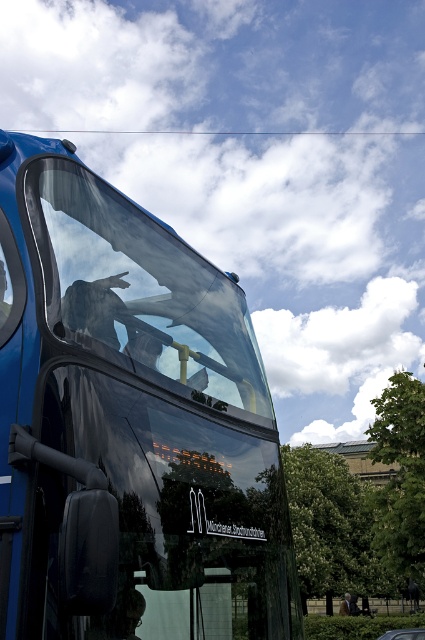
Question: Which of the following is the closest to the observer?

Choices:
 (A) click(147, 300)
 (B) click(124, 600)

Answer: (B)

Question: Which object appears farthest from the camera in this image?

Choices:
 (A) transparent glass windshield at upper center
 (B) shiny blue bus at center

Answer: (A)

Question: Which object is farther from the camera taking this photo?

Choices:
 (A) shiny blue bus at center
 (B) transparent glass windshield at upper center

Answer: (B)

Question: Does shiny blue bus at center have a greater width compared to transparent glass windshield at upper center?

Choices:
 (A) yes
 (B) no

Answer: (A)

Question: Can you confirm if shiny blue bus at center is thinner than transparent glass windshield at upper center?

Choices:
 (A) no
 (B) yes

Answer: (A)

Question: Is shiny blue bus at center above transparent glass windshield at upper center?

Choices:
 (A) no
 (B) yes

Answer: (A)